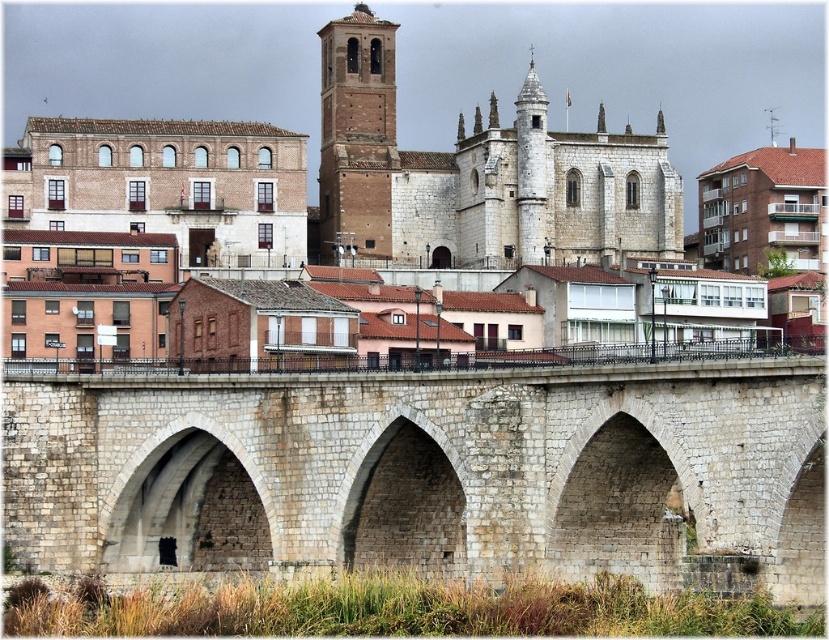
Question: Which object is positioned closest to the white stone arch at lower left?

Choices:
 (A) brown brick tower at upper center
 (B) white stone arch at center

Answer: (B)

Question: Is white stone arch at lower left to the left of brown brick tower at upper center from the viewer's perspective?

Choices:
 (A) yes
 (B) no

Answer: (B)

Question: Observing the image, what is the correct spatial positioning of white stone arch at lower left in reference to brown brick tower at upper center?

Choices:
 (A) above
 (B) below

Answer: (B)

Question: Does white stone church at center have a greater width compared to brown brick tower at upper center?

Choices:
 (A) no
 (B) yes

Answer: (B)

Question: Which point is closer to the camera?

Choices:
 (A) (388, 214)
 (B) (430, 451)

Answer: (B)

Question: Among these points, which one is nearest to the camera?

Choices:
 (A) (682, 484)
 (B) (212, 515)
 (C) (420, 472)
 (D) (726, 106)

Answer: (A)